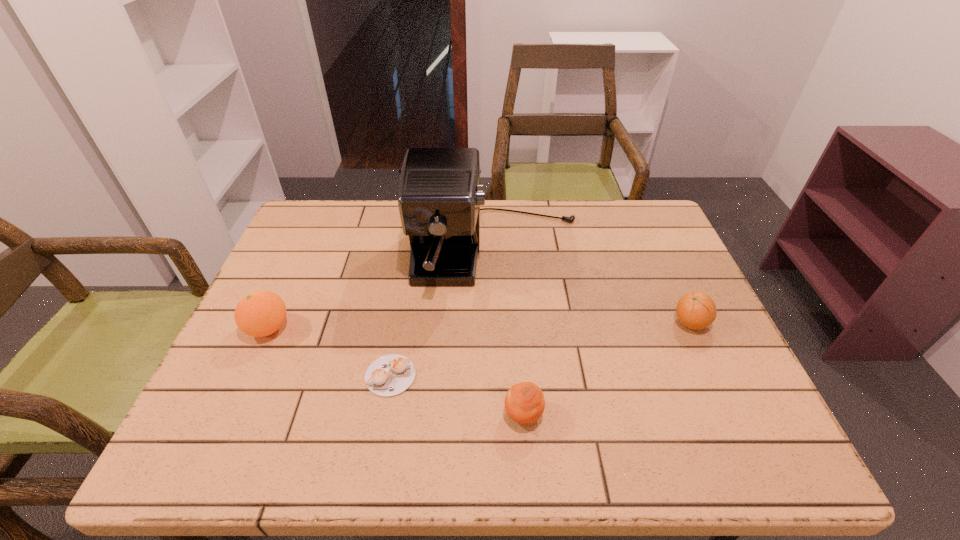
This screenshot has height=540, width=960. I want to click on free space located 0.060m on the right of the nearest orange, so (x=572, y=415).

The image size is (960, 540). What are the coordinates of `vacant space located on the front of the cappuccino` in the screenshot? It's located at pyautogui.click(x=383, y=420).

Find the location of a particular element. object at the far edge is located at coordinates (440, 194).

The width and height of the screenshot is (960, 540). I want to click on object located at the near edge, so (524, 402).

Where is `object at the left edge`? object at the left edge is located at coordinates (261, 313).

In order to click on object that is at the right edge in this screenshot , I will do [x=696, y=310].

Identify the location of vacant space at the far edge of the desktop. The height and width of the screenshot is (540, 960). (512, 225).

I want to click on vacant space at the near edge of the desktop, so click(x=450, y=450).

You are a GUI agent. You are given a task and a screenshot of the screen. Output one action in this format:
    pyautogui.click(x=<x>, y=<y>)
    Task: Click on the vacant space at the left edge of the desktop
    The height and width of the screenshot is (540, 960).
    Given the screenshot: What is the action you would take?
    pyautogui.click(x=316, y=271)

The width and height of the screenshot is (960, 540). Identify the location of vacant space at the far left corner of the desktop. (298, 247).